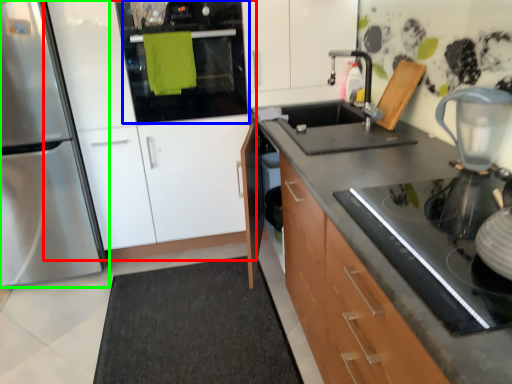
Question: Which is farther away from cabinetry (highlighted by a red box)? oven (highlighted by a blue box) or home appliance (highlighted by a green box)?

Choices:
 (A) oven
 (B) home appliance

Answer: (B)